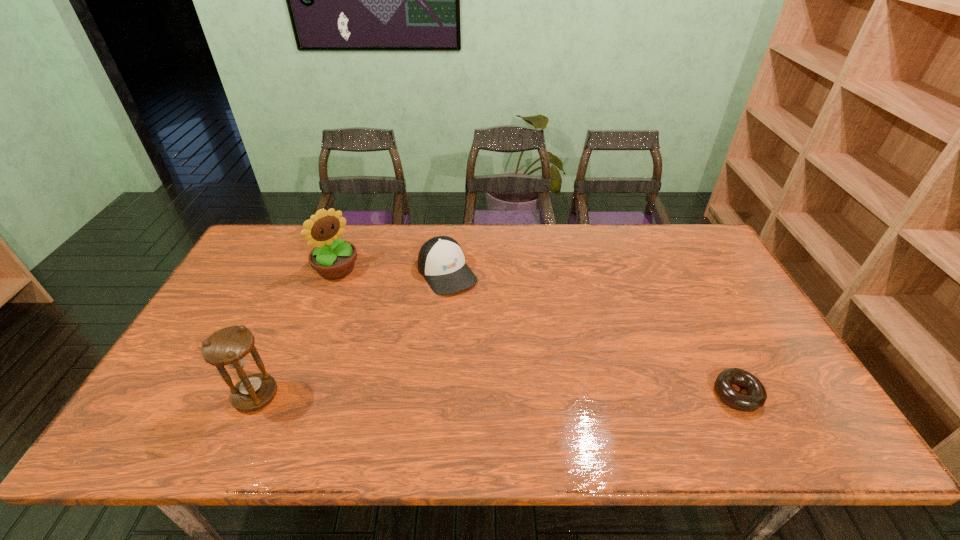
The width and height of the screenshot is (960, 540). Identify the location of hourglass. (229, 347).

I want to click on the rightmost object, so click(756, 396).

The height and width of the screenshot is (540, 960). Identify the location of doughnut. (756, 396).

Locate an element on the screen. This screenshot has height=540, width=960. sunflower is located at coordinates (332, 258).

Locate an element on the screen. The width and height of the screenshot is (960, 540). cap is located at coordinates (441, 261).

In order to click on the second shortest object in this screenshot , I will do `click(441, 261)`.

Where is `blank space located 0.200m on the right of the hourglass`? Image resolution: width=960 pixels, height=540 pixels. blank space located 0.200m on the right of the hourglass is located at coordinates 361,395.

Image resolution: width=960 pixels, height=540 pixels. Identify the location of vacant space located 0.170m on the back of the shortest object. (702, 326).

In order to click on vacant region located 0.220m on the face of the sunflower in this screenshot , I will do `click(390, 316)`.

Image resolution: width=960 pixels, height=540 pixels. In order to click on vacant region located 0.130m on the face of the sunflower in this screenshot , I will do `click(372, 300)`.